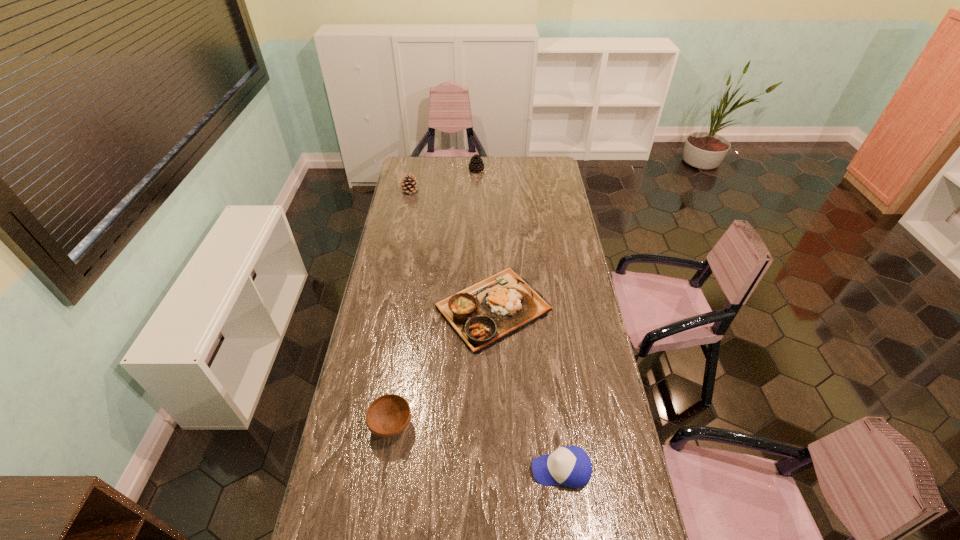
At what (x,y) coordinates should I click in order to perform the action: click on vacant point at the left edge. Please return your answer as a coordinate pair (x, y). Image resolution: width=960 pixels, height=540 pixels. Looking at the image, I should click on (374, 506).

Where is `blank space at the right edge of the desktop`? blank space at the right edge of the desktop is located at coordinates (536, 181).

In the image, there is a desktop. Where is `vacant space at the far right corner`? The width and height of the screenshot is (960, 540). vacant space at the far right corner is located at coordinates (557, 157).

Locate an element on the screen. vacant area that lies between the bowl and the right pinecone is located at coordinates (434, 298).

Image resolution: width=960 pixels, height=540 pixels. What are the coordinates of `free point between the fourth farthest object and the left pinecone` in the screenshot? It's located at (400, 308).

Identify the location of empty location between the fifth nearest object and the bowl. This screenshot has width=960, height=540. (400, 308).

Identify the location of free space between the fourth farthest object and the baseball cap. The image size is (960, 540). coord(476,447).

Locate an element on the screen. empty space between the platter and the nearer pinecone is located at coordinates (450, 250).

In order to click on free space between the nearer pinecone and the bowl in this screenshot , I will do `click(400, 308)`.

Where is `empty location between the second nearest object and the bowl`? This screenshot has height=540, width=960. empty location between the second nearest object and the bowl is located at coordinates (476, 447).